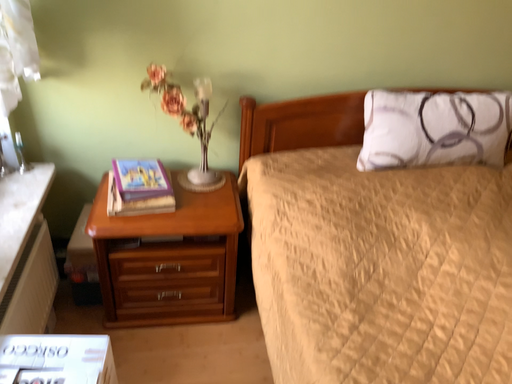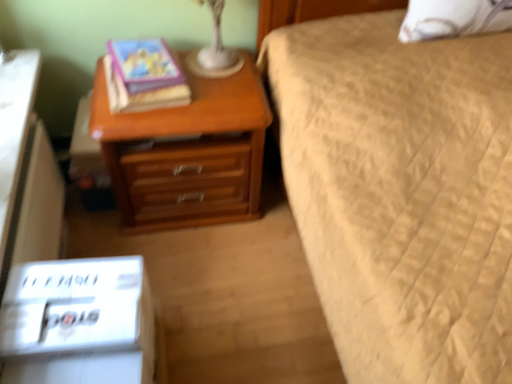
Question: Which way did the camera rotate in the video?

Choices:
 (A) rotated upward
 (B) rotated downward

Answer: (B)